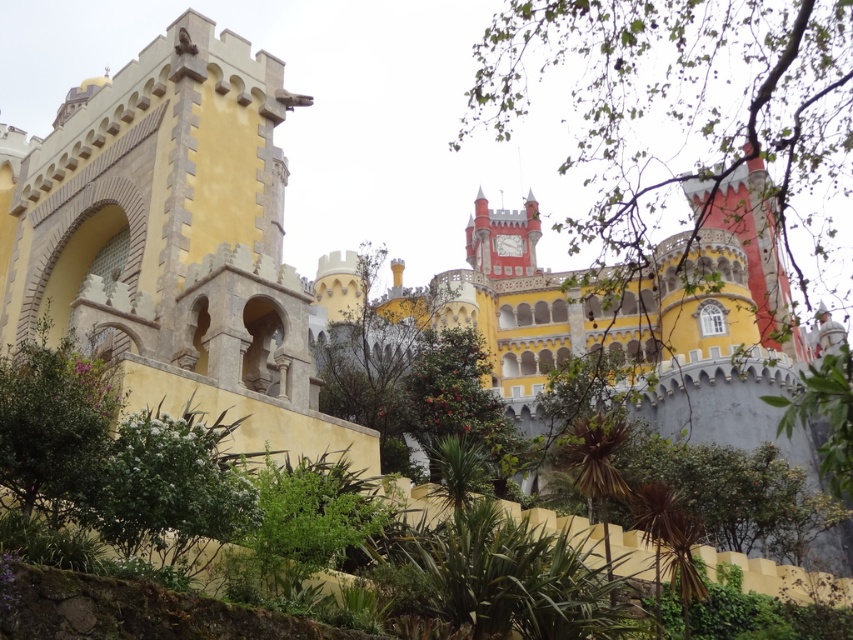
You are standing at the entrance of the Pena Palace and want to take a photo of the clock face on the central building. There is a green leafy bush at lower center in your way. Where should you move to avoid it?

Move to the left or right of the green leafy bush at lower center located at point (169, 490) to ensure the clock face is visible in your photo.

You are a landscape architect designing a garden path that needs to pass between the green leafy bush at lower center and the green leafy bush at left. Based on their sizes, which bush should the path be closer to?

The path should be closer to the green leafy bush at lower center because it is thinner than the green leafy bush at left, allowing more space around the larger bush.

In the scene shown: You are a landscape architect designing a garden path that needs to pass between the green leafy bush at lower center and the green leafy bush at left. Which bush should you consider for trimming to ensure the path is wide enough for a wheelchair?

The green leafy bush at lower center is smaller than the green leafy bush at left, so you should consider trimming the larger green leafy bush at left to widen the path sufficiently for wheelchair access.